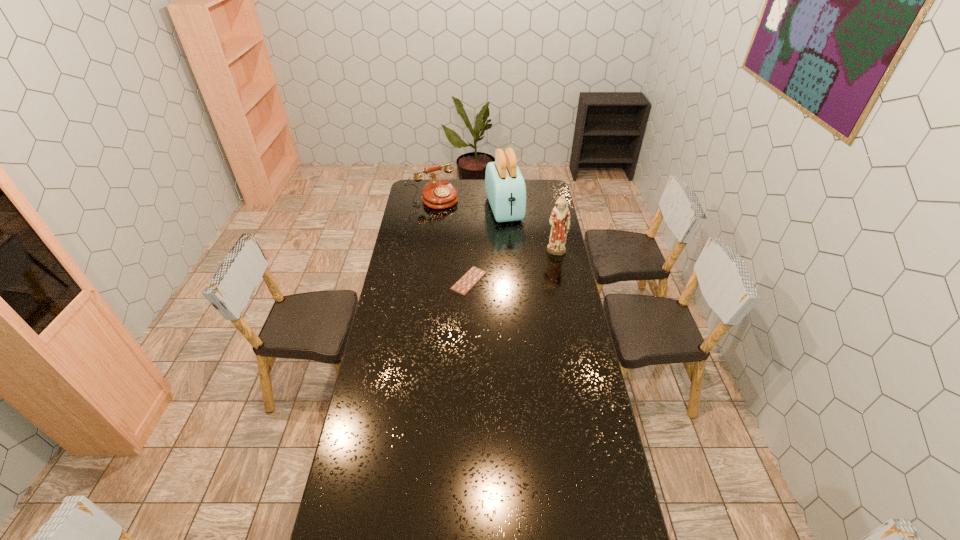
Find the location of a particular element. The image size is (960, 540). vacant space on the desktop that is between the nearest object and the second nearest object and is positioned on the side of the toaster with the lever is located at coordinates (525, 263).

Where is `free space on the desktop that is between the shortest object and the rightmost object and is positioned on the dial of the telephone`? free space on the desktop that is between the shortest object and the rightmost object and is positioned on the dial of the telephone is located at coordinates (502, 271).